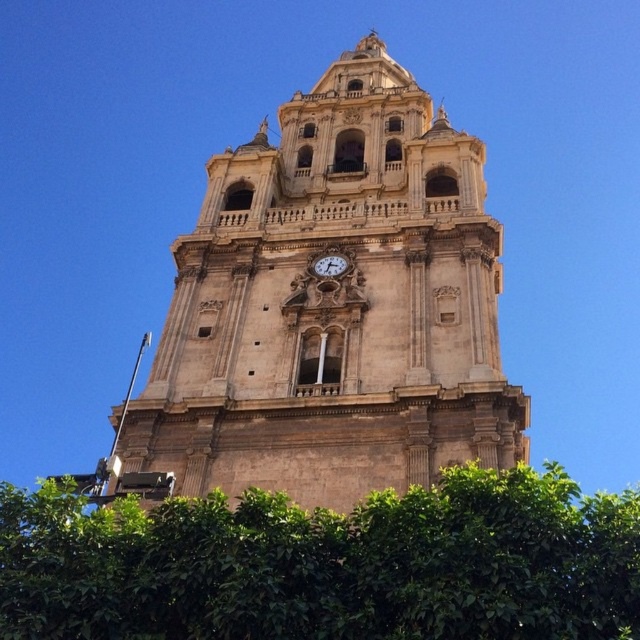
Question: Is beige stone clock tower at center bigger than white marble clock at center?

Choices:
 (A) no
 (B) yes

Answer: (B)

Question: Does green leafy tree at center appear on the left side of white marble clock at center?

Choices:
 (A) yes
 (B) no

Answer: (B)

Question: Which point is farther from the camera taking this photo?

Choices:
 (A) (182, 481)
 (B) (221, 600)

Answer: (A)

Question: Which object is positioned closest to the green leafy tree at center?

Choices:
 (A) white marble clock at center
 (B) beige stone clock tower at center

Answer: (A)

Question: Which point is farther to the camera?

Choices:
 (A) green leafy tree at center
 (B) beige stone clock tower at center
 (C) white marble clock at center

Answer: (C)

Question: Can you confirm if beige stone clock tower at center is positioned below white marble clock at center?

Choices:
 (A) yes
 (B) no

Answer: (B)